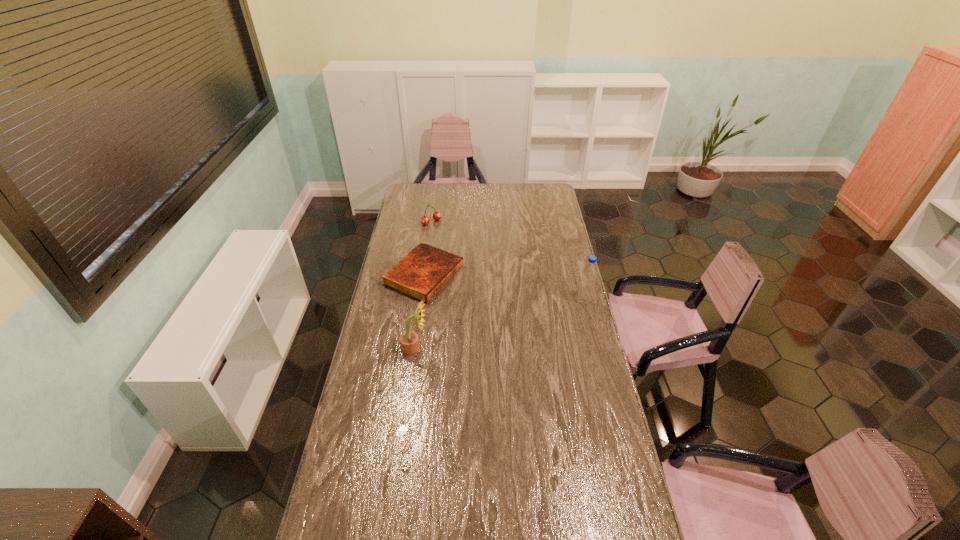
The image size is (960, 540). I want to click on vacant space at the right edge of the desktop, so click(x=575, y=276).

Where is `free spot at the far left corner of the desktop`? Image resolution: width=960 pixels, height=540 pixels. free spot at the far left corner of the desktop is located at coordinates (427, 201).

Locate an element on the screen. This screenshot has width=960, height=540. vacant area that lies between the rightmost object and the farthest object is located at coordinates (508, 261).

The width and height of the screenshot is (960, 540). Identify the location of vacant space in between the nearest object and the rightmost object. (499, 325).

I want to click on free point between the shortest object and the water bottle, so pyautogui.click(x=504, y=288).

At what (x,y) coordinates should I click in order to perform the action: click on object that ranks as the third closest to the sunflower. Please return your answer as a coordinate pair (x, y). Looking at the image, I should click on (425, 220).

The image size is (960, 540). I want to click on object that can be found as the closest to the cherry, so click(421, 274).

You are a GUI agent. You are given a task and a screenshot of the screen. Output one action in this format:
    pyautogui.click(x=<x>, y=<y>)
    Task: Click on the free point that satisfies the following two spatial constraints: 1. on the front side of the third tallest object; 2. on the left side of the rightmost object
    Image resolution: width=960 pixels, height=540 pixels.
    Given the screenshot: What is the action you would take?
    pyautogui.click(x=420, y=301)